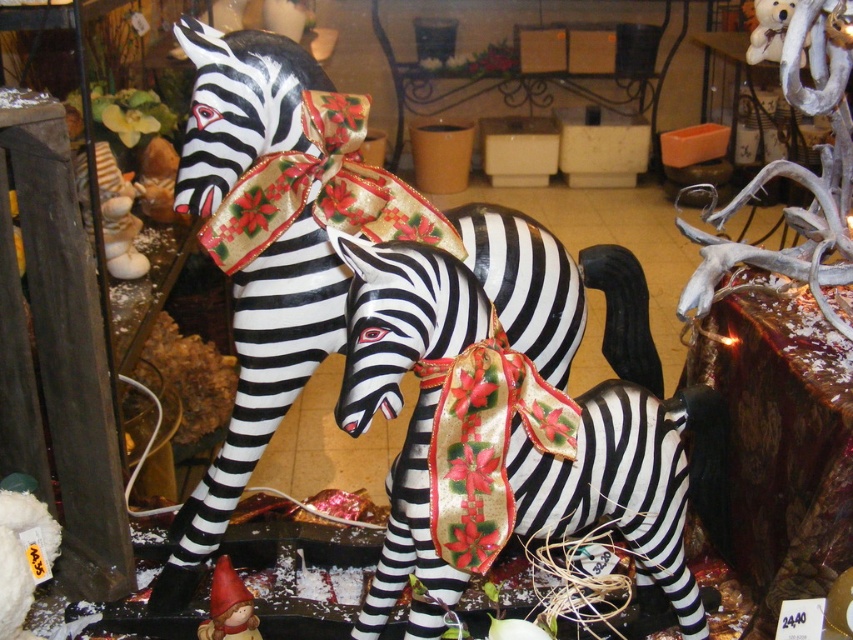
Is point (416, 476) farther from viewer compared to point (228, 593)?

No, it is in front of (228, 593).

Does shiny black and white striped zebra at center appear under matte plastic gnome at lower left?

Incorrect, shiny black and white striped zebra at center is not positioned below matte plastic gnome at lower left.

This screenshot has width=853, height=640. I want to click on shiny black and white striped zebra at center, so click(x=494, y=442).

Who is positioned more to the right, shiny black and white striped zebra at center or black and white striped zebra at center?

From the viewer's perspective, shiny black and white striped zebra at center appears more on the right side.

Is shiny black and white striped zebra at center to the left of black and white striped zebra at center from the viewer's perspective?

Incorrect, shiny black and white striped zebra at center is not on the left side of black and white striped zebra at center.

Locate an element on the screen. shiny black and white striped zebra at center is located at coordinates (494, 442).

Find the location of a particular element. shiny black and white striped zebra at center is located at coordinates (494, 442).

Does black and white striped zebra at center lie behind matte plastic gnome at lower left?

Yes, black and white striped zebra at center is behind matte plastic gnome at lower left.

Locate an element on the screen. The width and height of the screenshot is (853, 640). black and white striped zebra at center is located at coordinates (318, 259).